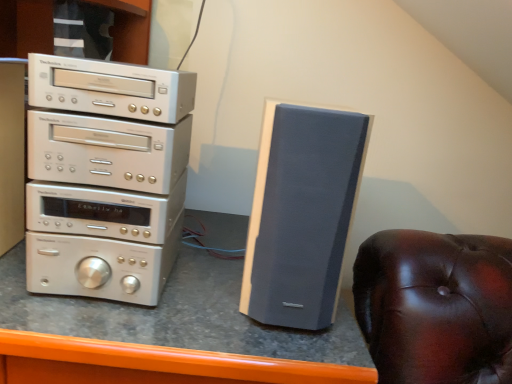
Question: Considering their positions, is silver metallic stereo stack at left located in front of or behind matte gray speaker at right?

Choices:
 (A) front
 (B) behind

Answer: (B)

Question: Would you say silver metallic stereo stack at left is to the left or to the right of matte gray speaker at right in the picture?

Choices:
 (A) right
 (B) left

Answer: (B)

Question: Which object is positioned farthest from the matte gray speaker at right?

Choices:
 (A) silver metallic stereo stack at left
 (B) matte gray speaker at center

Answer: (A)

Question: Considering the real-world distances, which object is farthest from the matte gray speaker at right?

Choices:
 (A) silver metallic stereo stack at left
 (B) matte gray speaker at center

Answer: (A)